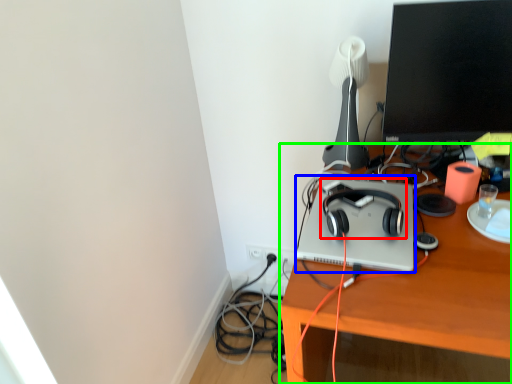
Question: Which object is the farthest from headphones (highlighted by a red box)? Choose among these: computer (highlighted by a blue box) or desk (highlighted by a green box).

Choices:
 (A) computer
 (B) desk

Answer: (B)